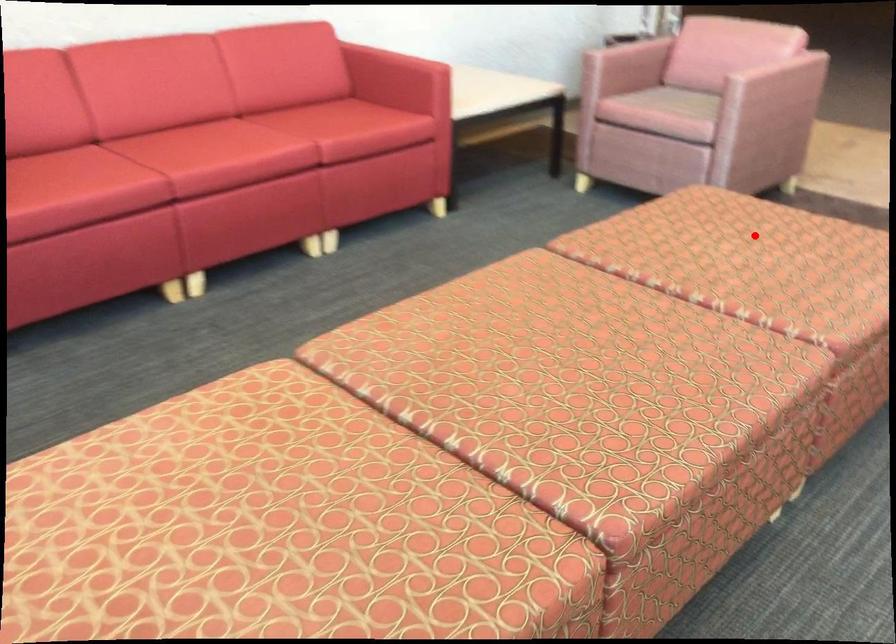
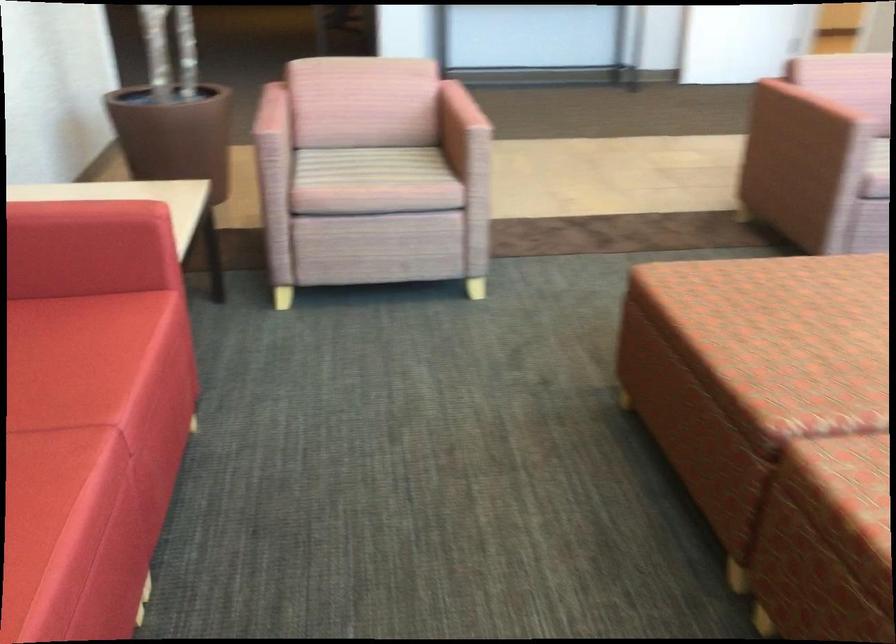
Question: I am providing you with two images of the same scene from different viewpoints. A red point is shown in image1. For the corresponding object point in image2, is it positioned nearer or farther from the camera?

Choices:
 (A) Nearer
 (B) Farther

Answer: (A)